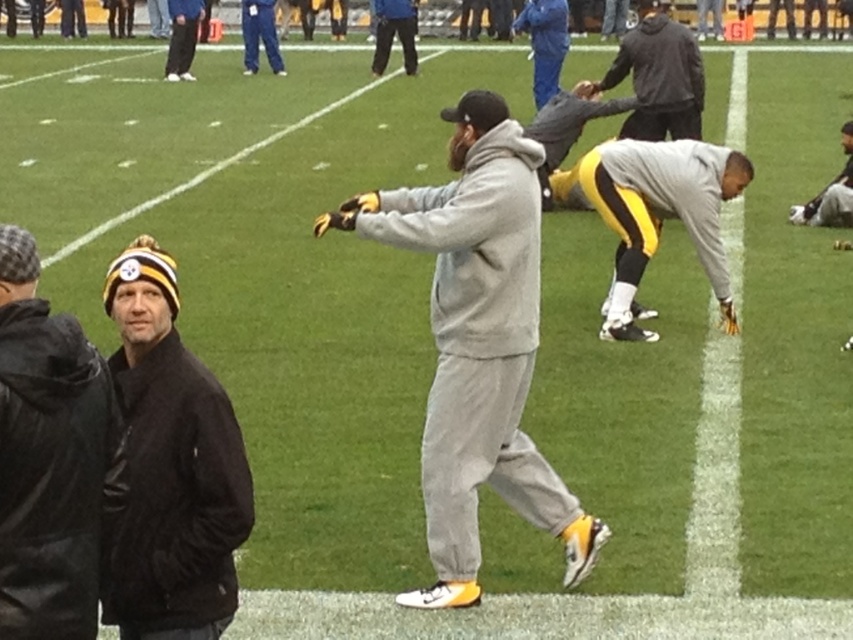
Who is positioned more to the right, gray/black athletic pants at center or yellow-black uniform at right?

From the viewer's perspective, yellow-black uniform at right appears more on the right side.

Is gray/black athletic pants at center to the left of yellow-black uniform at right from the viewer's perspective?

Yes, gray/black athletic pants at center is to the left of yellow-black uniform at right.

Where is `gray/black athletic pants at center`? Image resolution: width=853 pixels, height=640 pixels. gray/black athletic pants at center is located at coordinates (657, 212).

Locate an element on the screen. gray/black athletic pants at center is located at coordinates pos(657,212).

This screenshot has width=853, height=640. What do you see at coordinates (171, 465) in the screenshot?
I see `black leather jacket at left` at bounding box center [171, 465].

Is the position of black leather jacket at left more distant than that of gray/black athletic pants at center?

No, black leather jacket at left is closer to the viewer.

Where is `black leather jacket at left`? The image size is (853, 640). black leather jacket at left is located at coordinates (171, 465).

Image resolution: width=853 pixels, height=640 pixels. I want to click on blue fabric jacket at upper center, so click(544, 44).

Locate an element on the screen. Image resolution: width=853 pixels, height=640 pixels. blue fabric jacket at upper center is located at coordinates (544, 44).